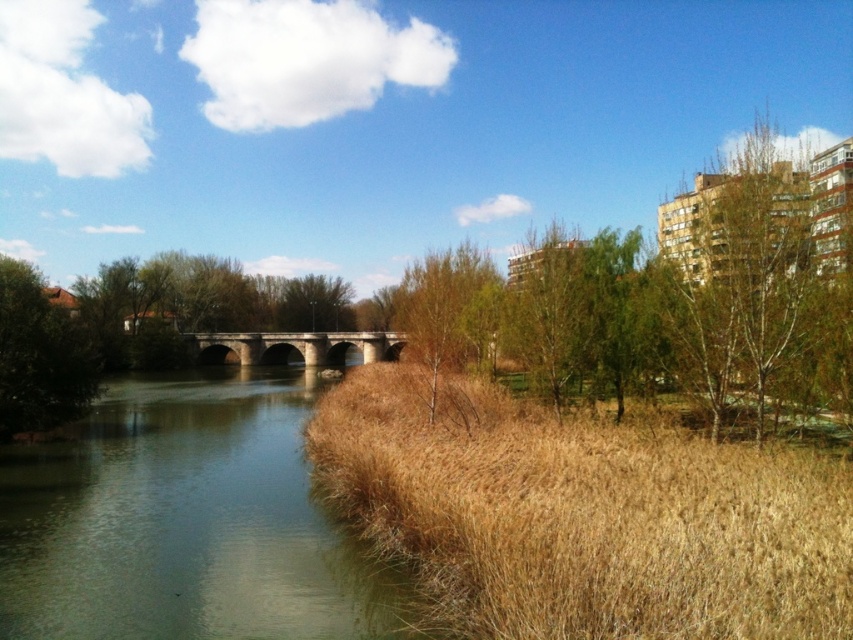
Looking at this image, who is more forward, [682,444] or [13,380]?

Point [682,444] is in front.

Is brown dry grass at lower right thinner than brown wood tree at left?

Indeed, brown dry grass at lower right has a lesser width compared to brown wood tree at left.

Does point (827, 628) lie in front of point (21, 280)?

Yes.

The width and height of the screenshot is (853, 640). I want to click on brown dry grass at lower right, so click(585, 516).

Does green leafy tree at upper right have a larger size compared to green matte tree at center?

Correct, green leafy tree at upper right is larger in size than green matte tree at center.

Which is more to the left, green leafy tree at upper right or green matte tree at center?

green matte tree at center is more to the left.

Which is behind, point (749, 301) or point (469, 280)?

Positioned behind is point (469, 280).

At what (x,y) coordinates should I click in order to perform the action: click on green leafy tree at upper right. Please return your answer as a coordinate pair (x, y). Looking at the image, I should click on (743, 266).

Which is more to the left, greenish-brown water at center or green leafy tree at upper right?

greenish-brown water at center

Between greenish-brown water at center and green leafy tree at upper right, which one has more height?

Standing taller between the two is green leafy tree at upper right.

You are a GUI agent. You are given a task and a screenshot of the screen. Output one action in this format:
    pyautogui.click(x=<x>, y=<y>)
    Task: Click on the greenish-brown water at center
    The height and width of the screenshot is (640, 853).
    Given the screenshot: What is the action you would take?
    pyautogui.click(x=183, y=522)

Image resolution: width=853 pixels, height=640 pixels. Identify the location of greenish-brown water at center. (183, 522).